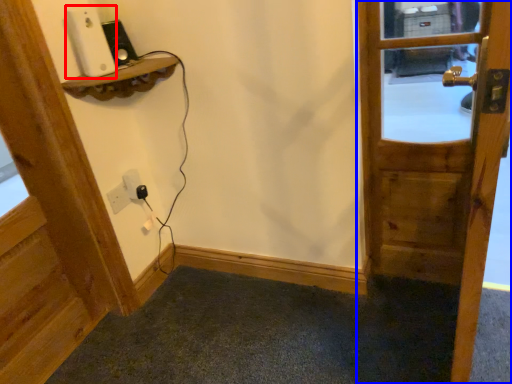
Question: Among these objects, which one is nearest to the camera, ipod (highlighted by a red box) or door (highlighted by a blue box)?

Choices:
 (A) ipod
 (B) door

Answer: (B)